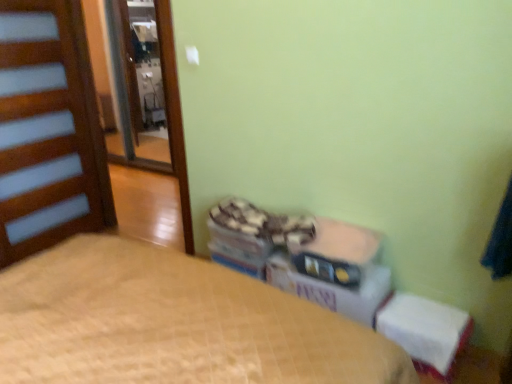
What do you see at coordinates (48, 130) in the screenshot? The width and height of the screenshot is (512, 384). I see `wooden door at left` at bounding box center [48, 130].

Where is `matte plastic storage box at center`? The height and width of the screenshot is (384, 512). matte plastic storage box at center is located at coordinates (335, 252).

In order to face brown wooden screen door at left, should I rotate leftwards or rightwards?

You should look left and rotate roughly 15.727 degrees.

At what (x,y) coordinates should I click in order to perform the action: click on wooden door at left. Please return your answer as a coordinate pair (x, y). The width and height of the screenshot is (512, 384). Looking at the image, I should click on (48, 130).

Considering the relative sizes of brown wooden screen door at left and wooden door at left in the image provided, is brown wooden screen door at left shorter than wooden door at left?

Yes.

Is point (176, 171) positioned in front of point (48, 74)?

Yes, it is.

Considering the sizes of objects brown wooden screen door at left and wooden door at left in the image provided, who is smaller, brown wooden screen door at left or wooden door at left?

With smaller size is brown wooden screen door at left.

From a real-world perspective, which is physically above, white fabric changing table at lower right or wooden door at left?

wooden door at left.

Considering the sizes of objects white fabric changing table at lower right and wooden door at left in the image provided, who is taller, white fabric changing table at lower right or wooden door at left?

Standing taller between the two is wooden door at left.

Between white fabric changing table at lower right and wooden door at left, which one is positioned in front?

white fabric changing table at lower right.

Would you consider white fabric changing table at lower right to be distant from wooden door at left?

Indeed, white fabric changing table at lower right is not near wooden door at left.

From the picture: Would you say wooden door at left is a long distance from white cardboard box at center?

wooden door at left is positioned a significant distance from white cardboard box at center.

Find the location of a particular element. door above the white cardboard box at center (from a real-world perspective) is located at coordinates (48, 130).

Who is bigger, wooden door at left or white cardboard box at center?

wooden door at left is bigger.

Would you say white cardboard box at center is part of wooden door at left's contents?

No, white cardboard box at center is not a part of wooden door at left.

Considering the sizes of objects white fabric changing table at lower right and brown wooden screen door at left in the image provided, who is shorter, white fabric changing table at lower right or brown wooden screen door at left?

white fabric changing table at lower right.

How different are the orientations of white fabric changing table at lower right and brown wooden screen door at left in degrees?

white fabric changing table at lower right and brown wooden screen door at left are facing 0.0871 degrees away from each other.

Does white fabric changing table at lower right have a larger size compared to brown wooden screen door at left?

Incorrect, white fabric changing table at lower right is not larger than brown wooden screen door at left.

Which is correct: white fabric changing table at lower right is inside brown wooden screen door at left, or outside of it?

white fabric changing table at lower right exists outside the volume of brown wooden screen door at left.

Is beige quilted bed at center outside of wooden door at left?

Yes, beige quilted bed at center is located beyond the bounds of wooden door at left.

Is the position of beige quilted bed at center less distant than that of wooden door at left?

Yes, it is in front of wooden door at left.

Is beige quilted bed at center oriented away from wooden door at left?

No, beige quilted bed at center is not facing the opposite direction of wooden door at left.

From the image's perspective, is white fabric changing table at lower right positioned above or below matte plastic storage box at center?

From the image's perspective, white fabric changing table at lower right appears below matte plastic storage box at center.

Where is `changing table on the right of matte plastic storage box at center`? This screenshot has width=512, height=384. changing table on the right of matte plastic storage box at center is located at coordinates (423, 328).

From a real-world perspective, relative to matte plastic storage box at center, is white fabric changing table at lower right vertically above or below?

Clearly, from a real-world perspective, white fabric changing table at lower right is below matte plastic storage box at center.

Is white fabric changing table at lower right taller than matte plastic storage box at center?

Indeed, white fabric changing table at lower right has a greater height compared to matte plastic storage box at center.

Does beige quilted bed at center lie behind brown wooden screen door at left?

No, the depth of beige quilted bed at center is less than that of brown wooden screen door at left.

Is beige quilted bed at center touching brown wooden screen door at left?

No, beige quilted bed at center is not in contact with brown wooden screen door at left.

How far apart are beige quilted bed at center and brown wooden screen door at left?

8.08 feet.

From the image's perspective, does beige quilted bed at center appear lower than brown wooden screen door at left?

Yes, from the image's perspective, beige quilted bed at center is below brown wooden screen door at left.

Identify the location of door on the left of the brown wooden screen door at left. (48, 130).

Find the location of a particular element. This screenshot has height=384, width=512. door behind the white fabric changing table at lower right is located at coordinates (48, 130).

When comparing their distances from white fabric changing table at lower right, does white cardboard box at center or matte plastic storage box at center seem closer?

The object closer to white fabric changing table at lower right is white cardboard box at center.

In the scene shown: From the image, which object appears to be nearer to beige quilted bed at center, white fabric changing table at lower right or matte plastic storage box at center?

Based on the image, matte plastic storage box at center appears to be nearer to beige quilted bed at center.

From the image, which object appears to be nearer to matte plastic storage box at center, white cardboard box at center or brown wooden screen door at left?

white cardboard box at center is closer to matte plastic storage box at center.

From the image, which object appears to be farther from wooden door at left, matte plastic storage box at center or brown wooden screen door at left?

matte plastic storage box at center is further to wooden door at left.

When comparing their distances from matte plastic storage box at center, does brown wooden screen door at left or beige quilted bed at center seem closer?

beige quilted bed at center is positioned closer to the anchor matte plastic storage box at center.

Estimate the real-world distances between objects in this image. Which object is further from white cardboard box at center, brown wooden screen door at left or beige quilted bed at center?

brown wooden screen door at left is further to white cardboard box at center.

Which object lies nearer to the anchor point white cardboard box at center, white fabric changing table at lower right or matte plastic storage box at center?

The object closer to white cardboard box at center is matte plastic storage box at center.

Looking at the image, which one is located closer to matte plastic storage box at center, white fabric changing table at lower right or white cardboard box at center?

white cardboard box at center is closer to matte plastic storage box at center.

The width and height of the screenshot is (512, 384). I want to click on storage box between white cardboard box at center and white fabric changing table at lower right from left to right, so click(x=335, y=252).

Identify the location of storage box between brown wooden screen door at left and white fabric changing table at lower right from left to right. The image size is (512, 384). (335, 252).

Locate an element on the screen. The width and height of the screenshot is (512, 384). cardboard box between wooden door at left and white fabric changing table at lower right from left to right is located at coordinates (334, 288).

You are a GUI agent. You are given a task and a screenshot of the screen. Output one action in this format:
    pyautogui.click(x=<x>, y=<y>)
    Task: Click on the storage box between wooden door at left and white fabric changing table at lower right in the horizontal direction
    The height and width of the screenshot is (384, 512).
    Given the screenshot: What is the action you would take?
    [335, 252]